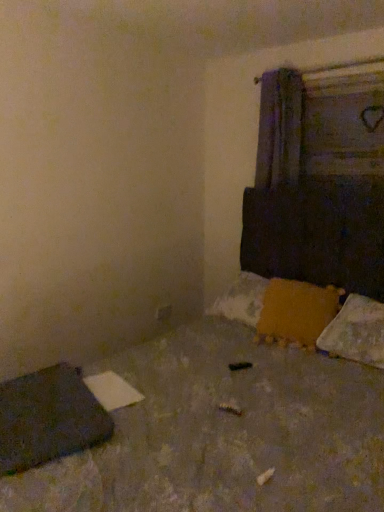
This screenshot has width=384, height=512. Identify the location of free space above dark gray fabric at lower left (from a real-world perspective). (38, 395).